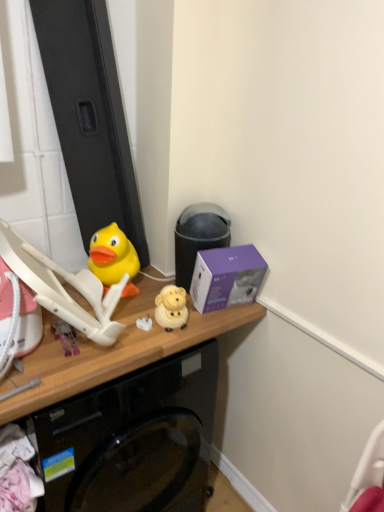
You are a GUI agent. You are given a task and a screenshot of the screen. Output one action in this format:
    pyautogui.click(x=<x>, y=<y>)
    Task: Click on the vacant space to the right of yellow matte sheep at center, marked as the fourth toy in a left-to-right arrangement
    The height and width of the screenshot is (512, 384).
    Given the screenshot: What is the action you would take?
    pyautogui.click(x=216, y=316)